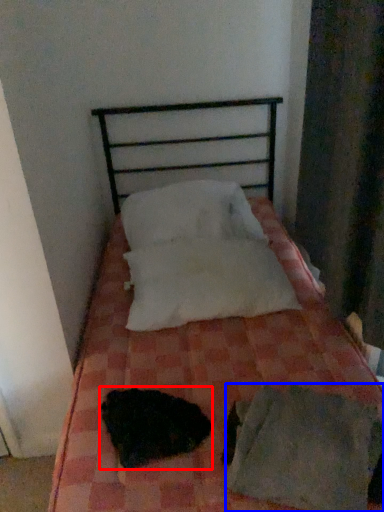
Question: Which of the following is the farthest to the observer, animal (highlighted by a red box) or sheet (highlighted by a blue box)?

Choices:
 (A) animal
 (B) sheet

Answer: (A)